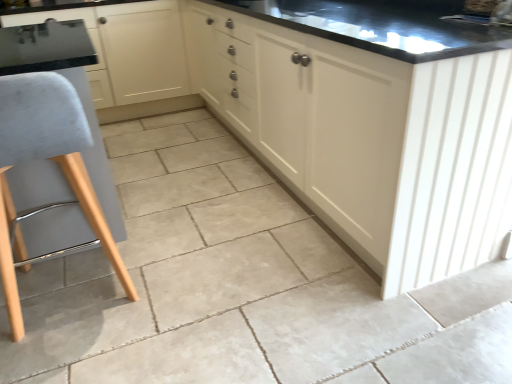
Question: Can you confirm if matte black sink at upper center is bigger than light gray fabric stool at left?

Choices:
 (A) no
 (B) yes

Answer: (A)

Question: Does matte black sink at upper center have a greater width compared to light gray fabric stool at left?

Choices:
 (A) yes
 (B) no

Answer: (B)

Question: Is matte black sink at upper center shorter than light gray fabric stool at left?

Choices:
 (A) no
 (B) yes

Answer: (B)

Question: Can you confirm if matte black sink at upper center is taller than light gray fabric stool at left?

Choices:
 (A) yes
 (B) no

Answer: (B)

Question: Does matte black sink at upper center contain light gray fabric stool at left?

Choices:
 (A) yes
 (B) no

Answer: (B)

Question: Can you confirm if matte black sink at upper center is smaller than light gray fabric stool at left?

Choices:
 (A) yes
 (B) no

Answer: (A)

Question: Can you confirm if matte black sink at upper center is shorter than matte cream cabinet at center, which ranks as the 2th cabinetry in left-to-right order?

Choices:
 (A) no
 (B) yes

Answer: (B)

Question: From a real-world perspective, is matte black sink at upper center physically above matte cream cabinet at center, arranged as the 1th cabinetry when viewed from the right?

Choices:
 (A) no
 (B) yes

Answer: (B)

Question: Considering the relative sizes of matte black sink at upper center and matte cream cabinet at center, arranged as the 1th cabinetry when viewed from the right, in the image provided, is matte black sink at upper center thinner than matte cream cabinet at center, arranged as the 1th cabinetry when viewed from the right,?

Choices:
 (A) no
 (B) yes

Answer: (B)

Question: Can you confirm if matte black sink at upper center is bigger than matte cream cabinet at center, which ranks as the 2th cabinetry in left-to-right order?

Choices:
 (A) no
 (B) yes

Answer: (A)

Question: Is matte black sink at upper center touching matte cream cabinet at center, arranged as the 1th cabinetry when viewed from the right?

Choices:
 (A) no
 (B) yes

Answer: (A)

Question: Considering the relative positions of matte black sink at upper center and matte cream cabinet at center, which ranks as the 2th cabinetry in left-to-right order, in the image provided, is matte black sink at upper center behind matte cream cabinet at center, which ranks as the 2th cabinetry in left-to-right order,?

Choices:
 (A) yes
 (B) no

Answer: (A)

Question: Does matte cream cabinet at center, arranged as the 1th cabinetry when viewed from the right, turn towards light gray fabric stool at left?

Choices:
 (A) no
 (B) yes

Answer: (B)